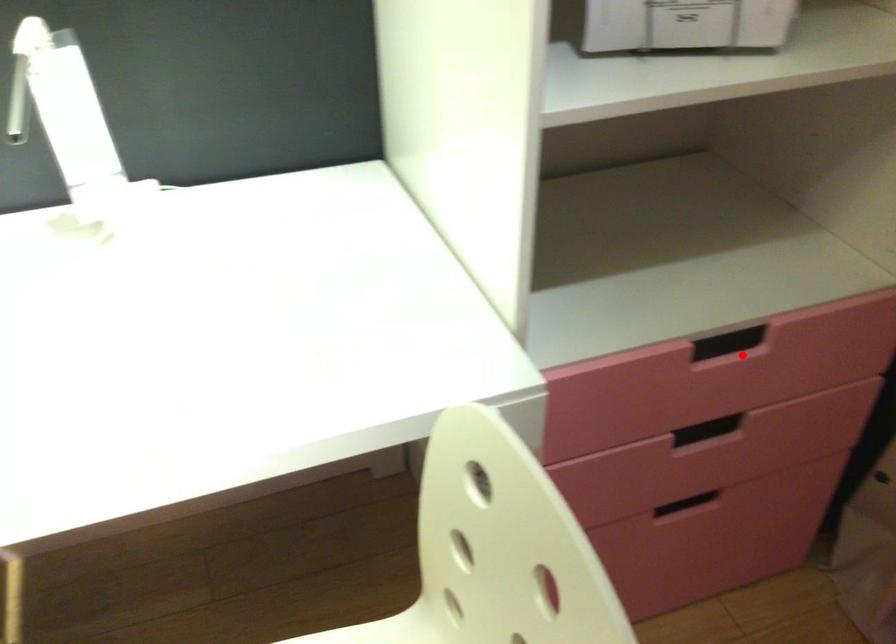
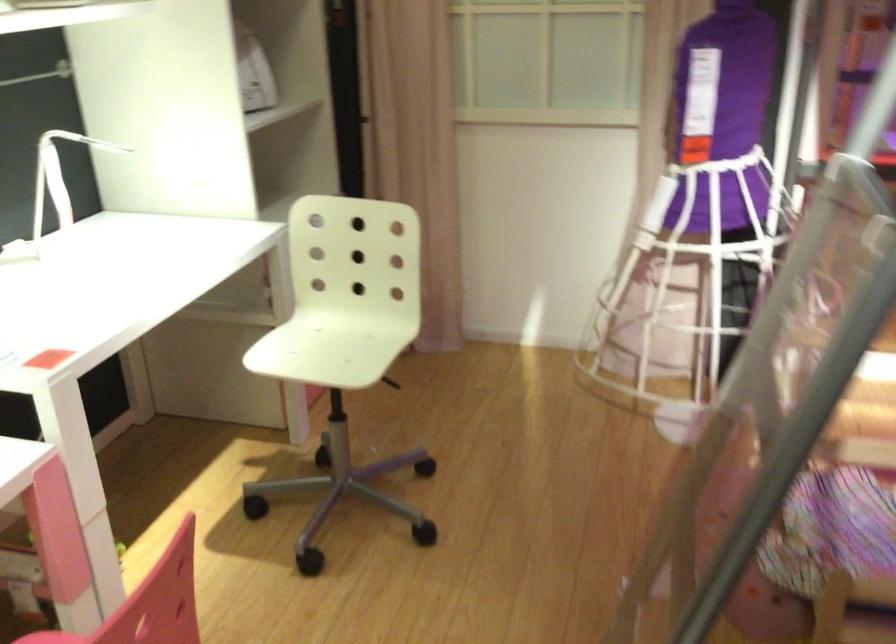
Question: I am providing you with two images of the same scene from different viewpoints. A red point is marked on the first image. At the location where the point appears in image 1, is it still visible in image 2?

Choices:
 (A) Yes
 (B) No

Answer: (B)